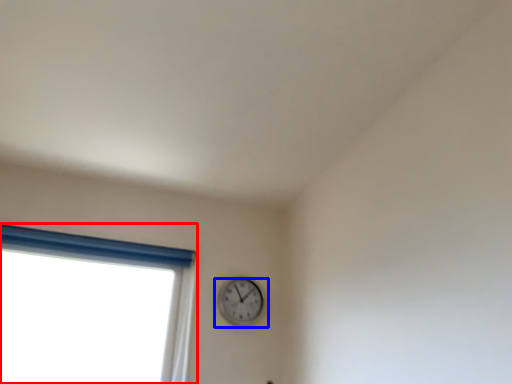
Question: Which point is closer to the camera, window (highlighted by a red box) or wall clock (highlighted by a blue box)?

Choices:
 (A) window
 (B) wall clock

Answer: (A)